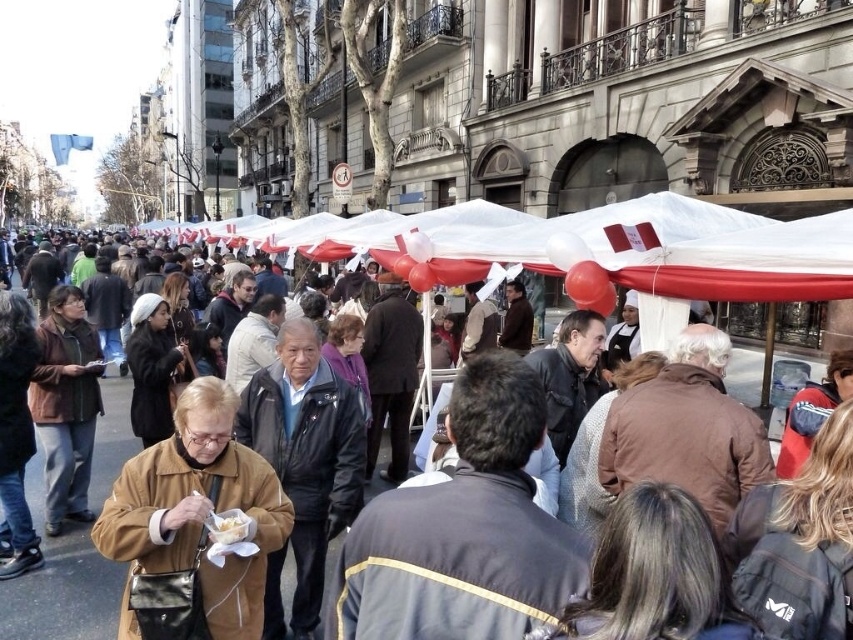
Question: Which is nearer to the brown leather jacket at center?

Choices:
 (A) white paper food at center
 (B) white paper bag at center

Answer: (B)

Question: Is brown leather jacket at center smaller than white paper bag at center?

Choices:
 (A) yes
 (B) no

Answer: (B)

Question: Can you confirm if brown leather jacket at center is positioned to the right of white paper food at center?

Choices:
 (A) no
 (B) yes

Answer: (B)

Question: Considering the real-world distances, which object is closest to the white paper food at center?

Choices:
 (A) white paper bag at center
 (B) brown leather jacket at center

Answer: (A)

Question: Is white paper bag at center to the right of white paper food at center from the viewer's perspective?

Choices:
 (A) yes
 (B) no

Answer: (B)

Question: Estimate the real-world distances between objects in this image. Which object is closer to the white paper bag at center?

Choices:
 (A) white paper food at center
 (B) brown leather jacket at center

Answer: (A)